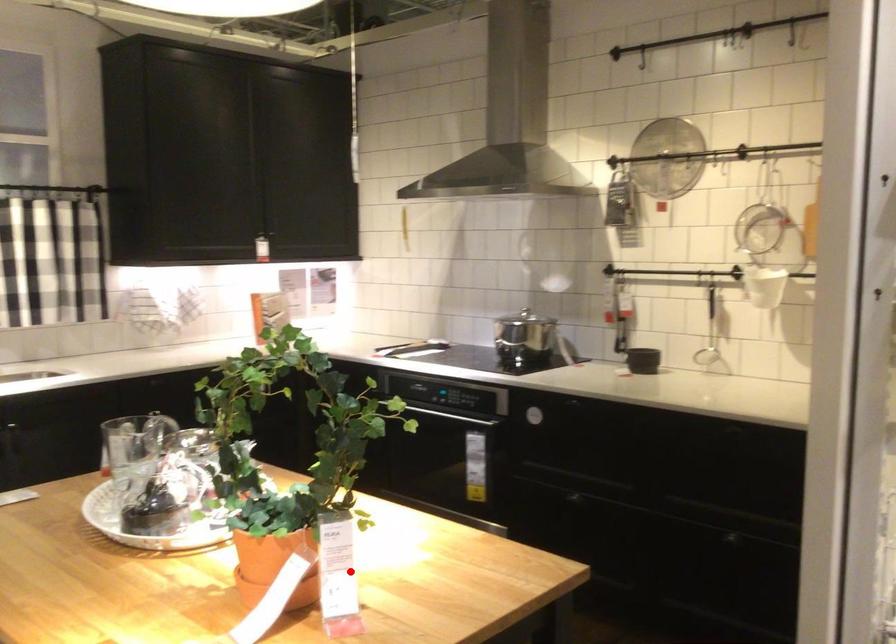
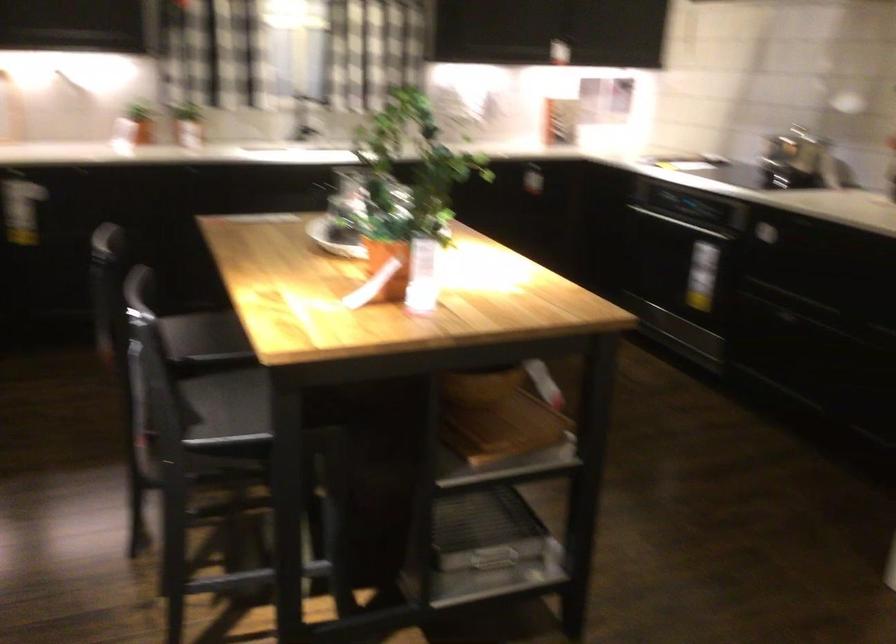
Question: I am providing you with two images of the same scene from different viewpoints. A red point is marked on the first image. Can you still see the location of the red point in image 2?

Choices:
 (A) Yes
 (B) No

Answer: (A)